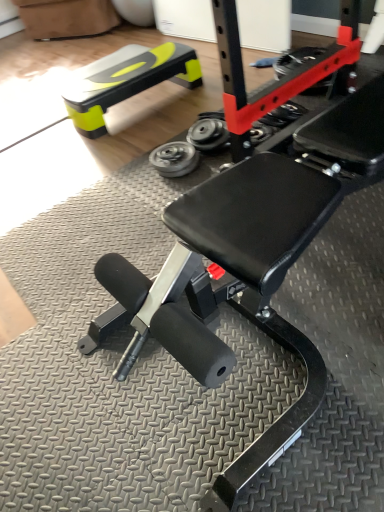
Locate an element on the screen. This screenshot has width=384, height=512. vacant space in neon yellow plastic bench at upper left (from a real-world perspective) is located at coordinates (154, 99).